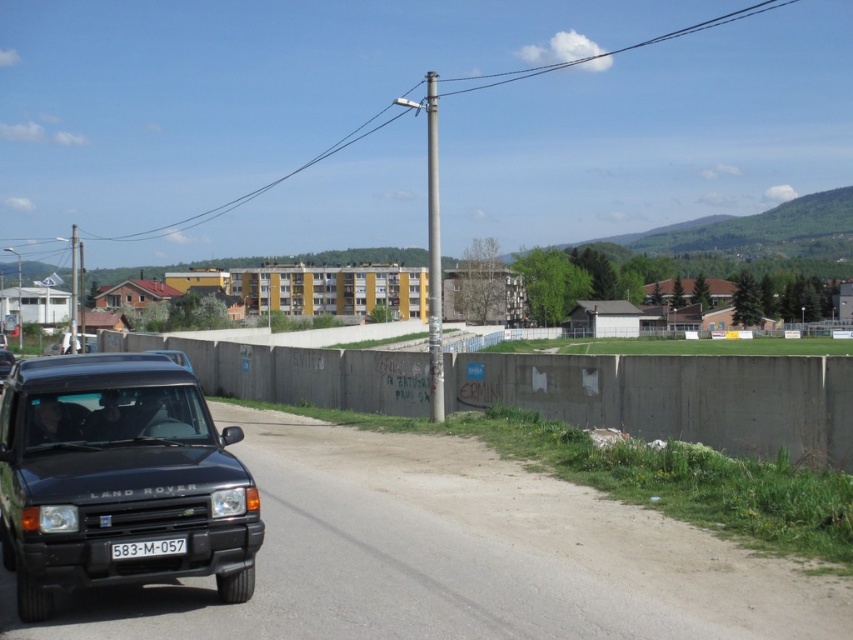
Consider the image. Does black matte suv at lower left come in front of concrete wall at center?

Yes, it is.

Between black matte suv at lower left and concrete wall at center, which one appears on the right side from the viewer's perspective?

black matte suv at lower left is more to the right.

Locate an element on the screen. Image resolution: width=853 pixels, height=640 pixels. black matte suv at lower left is located at coordinates (119, 477).

Locate an element on the screen. concrete wall at center is located at coordinates (675, 397).

Who is shorter, concrete wall at center or white plastic license plate at lower center?

white plastic license plate at lower center

Image resolution: width=853 pixels, height=640 pixels. What do you see at coordinates (675, 397) in the screenshot?
I see `concrete wall at center` at bounding box center [675, 397].

Find the location of a particular element. This screenshot has height=640, width=853. concrete wall at center is located at coordinates (675, 397).

Does black matte suv at lower left have a larger size compared to white plastic license plate at lower center?

Correct, black matte suv at lower left is larger in size than white plastic license plate at lower center.

Is point (149, 438) closer to camera compared to point (138, 550)?

No, (149, 438) is behind (138, 550).

Identify the location of black matte suv at lower left. (119, 477).